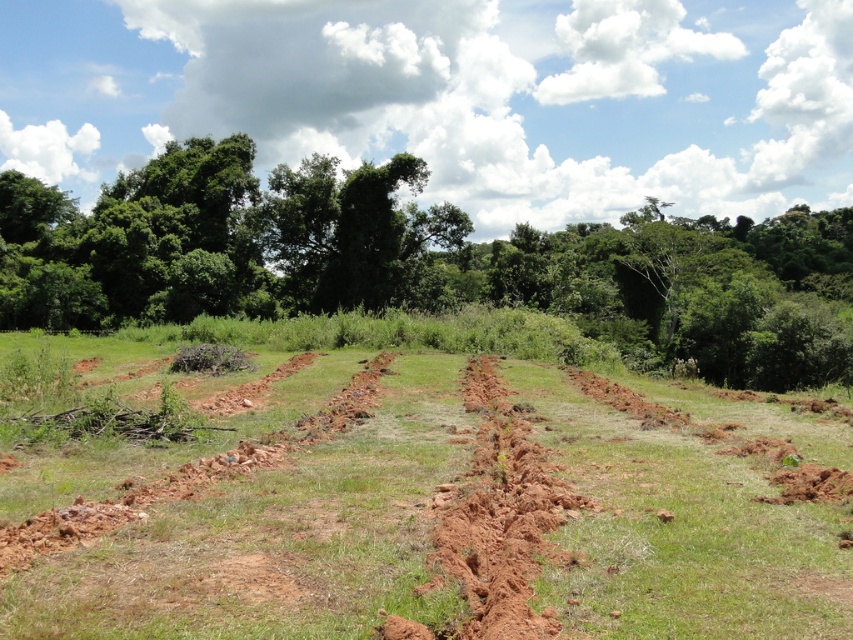
You are a farmer checking the field. You notice the brown soil at center and the green leafy tree at center. Which one is positioned lower in the image?

The brown soil at center is located below the green leafy tree at center, so the brown soil at center is positioned lower in the image.

You are a farmer standing at the edge of the field. You see the brown soil at center and the green leafy tree at center. Which one is closer to you?

The brown soil at center is closer to you since it is in front of the green leafy tree at center.